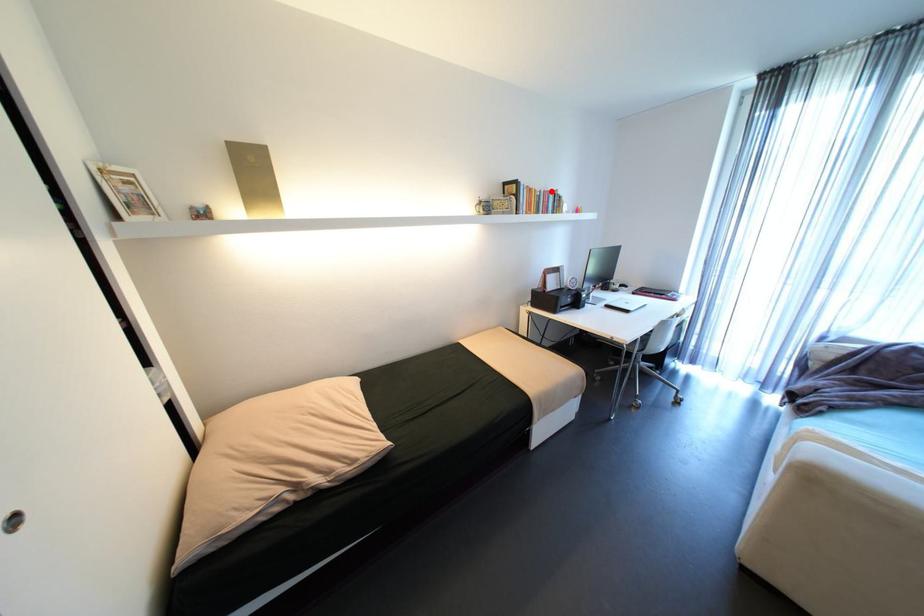
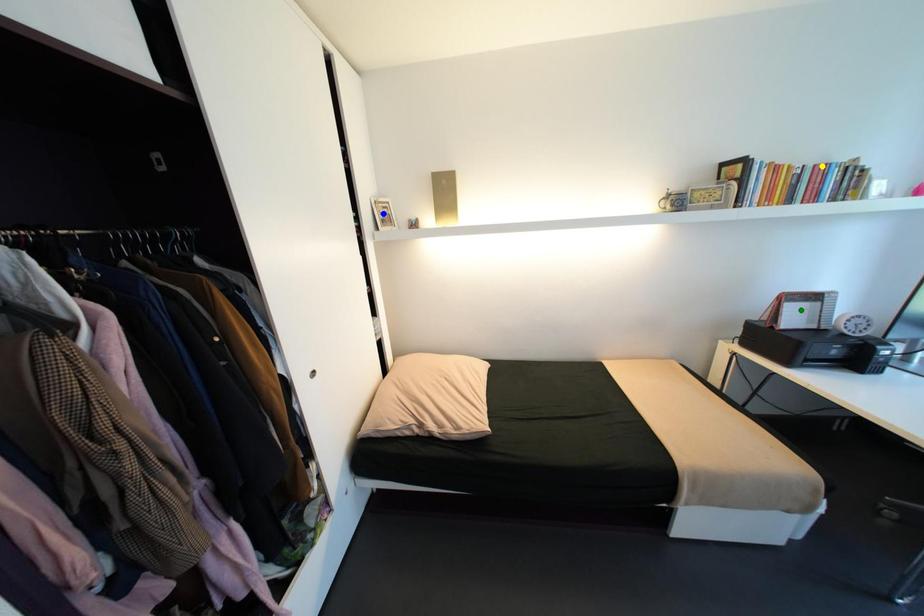
Question: I am providing you with two images of the same scene from different viewpoints. A red point is marked on the first image. You are given multiple points on the second image. Which spot in image 2 lines up with the point in image 1?

Choices:
 (A) yellow point
 (B) green point
 (C) blue point

Answer: (A)